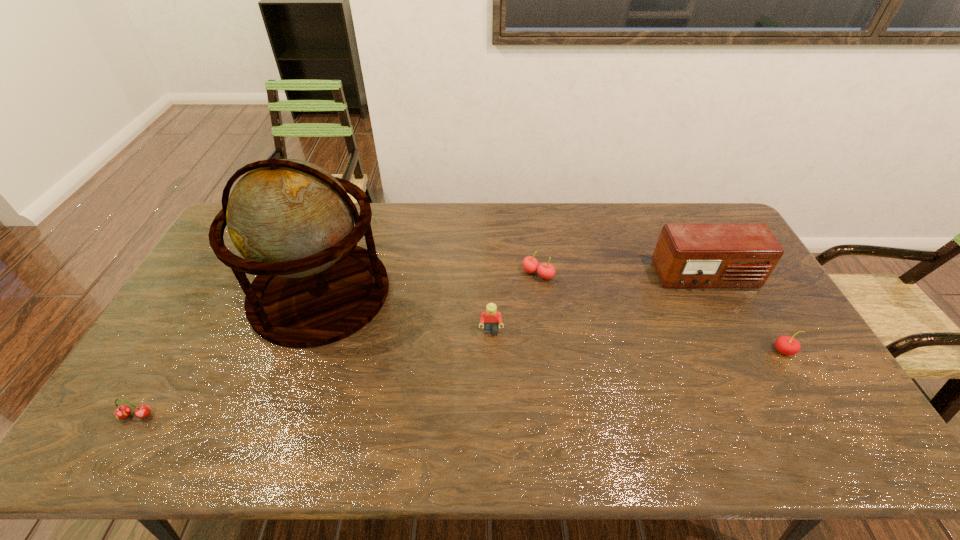
This screenshot has height=540, width=960. Identify the location of free space located 0.280m on the front-facing side of the radio receiver. (753, 369).

I want to click on vacant region located 0.050m on the face of the Lego, so click(x=492, y=352).

You are a GUI agent. You are given a task and a screenshot of the screen. Output one action in this format:
    pyautogui.click(x=<x>, y=<y>)
    Task: Click on the free location located on the left of the rightmost cherry
    This screenshot has width=960, height=540.
    Given the screenshot: What is the action you would take?
    pyautogui.click(x=634, y=351)

You are a GUI agent. You are given a task and a screenshot of the screen. Output one action in this format:
    pyautogui.click(x=<x>, y=<y>)
    Task: Click on the blank area located 0.140m on the back of the farthest cherry
    
    Given the screenshot: What is the action you would take?
    pyautogui.click(x=533, y=238)

The width and height of the screenshot is (960, 540). I want to click on vacant region located with stems pointing upwards on the leftmost object, so click(x=115, y=450).

In order to click on object located at the left edge in this screenshot , I will do `click(122, 411)`.

The height and width of the screenshot is (540, 960). Find the location of `radio receiver that is at the right edge`. radio receiver that is at the right edge is located at coordinates (688, 255).

The image size is (960, 540). In order to click on cherry that is at the right edge in this screenshot , I will do `click(786, 345)`.

In order to click on free space at the far edge of the desktop in this screenshot , I will do `click(374, 240)`.

This screenshot has height=540, width=960. I want to click on vacant space at the near edge, so click(x=336, y=434).